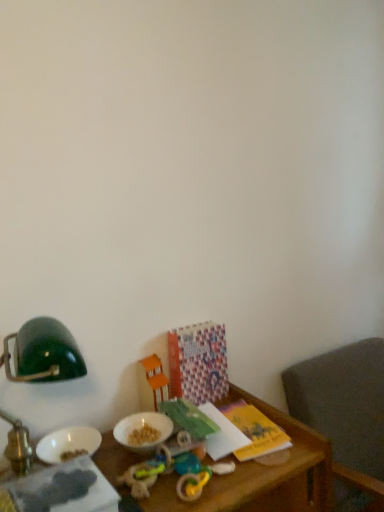
I want to click on vacant space to the right of rubber teething ring at lower center, which is counted as the 3th toy, starting from the back, so click(255, 470).